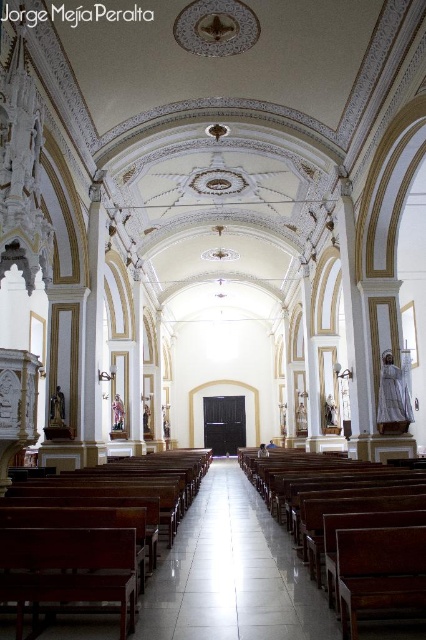
Does point (169, 490) lie behind point (296, 502)?

Yes, it is.

Is polished wood bench at center thinner than wooden church bench at center?

Yes, polished wood bench at center is thinner than wooden church bench at center.

Which is behind, point (129, 609) or point (362, 506)?

The point (362, 506) is more distant.

This screenshot has width=426, height=640. Identify the location of polished wood bench at center. (86, 538).